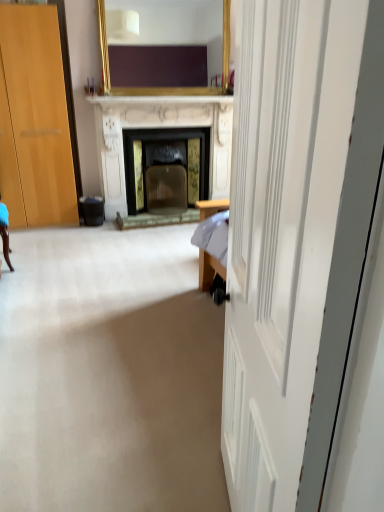
Measure the distance between gold-framed mirror at upper center and camera.

gold-framed mirror at upper center is 3.36 meters away from camera.

This screenshot has width=384, height=512. Describe the element at coordinates (92, 210) in the screenshot. I see `black plastic trash bin at lower left` at that location.

Identify the location of white marble fireplace at center. This screenshot has height=512, width=384. (154, 130).

You are a GUI agent. You are given a task and a screenshot of the screen. Output one action in this format:
    pyautogui.click(x=<x>, y=<y>)
    Task: Click on the gold-framed mirror at upper center
    The image size is (384, 512).
    Given the screenshot: What is the action you would take?
    pyautogui.click(x=164, y=88)

From a real-world perspective, is gold-framed mirror at upper center located higher than black plastic trash bin at lower left?

Yes, from a real-world perspective, gold-framed mirror at upper center is over black plastic trash bin at lower left

Is gold-framed mirror at upper center wider or thinner than black plastic trash bin at lower left?

In the image, gold-framed mirror at upper center appears to be more narrow than black plastic trash bin at lower left.

Is black plastic trash bin at lower left inside gold-framed mirror at upper center?

No, black plastic trash bin at lower left is not a part of gold-framed mirror at upper center.

Which is in front, point (104, 17) or point (95, 208)?

Positioned in front is point (95, 208).

Does gold-framed mirror at upper center have a larger size compared to white wooden door at center?

Actually, gold-framed mirror at upper center might be smaller than white wooden door at center.

Based on the photo, is gold-framed mirror at upper center next to white wooden door at center and touching it?

There is a gap between gold-framed mirror at upper center and white wooden door at center.

Is gold-framed mirror at upper center at the right side of white wooden door at center?

No.

From a real-world perspective, who is located higher, gold-framed mirror at upper center or white marble fireplace at center?

From a 3D spatial view, gold-framed mirror at upper center is above.

Looking at this image, from the image's perspective, which is above, gold-framed mirror at upper center or white marble fireplace at center?

gold-framed mirror at upper center appears higher in the image.

Is the depth of gold-framed mirror at upper center greater than that of white marble fireplace at center?

That is False.

Does point (308, 345) come in front of point (100, 13)?

Yes, it is.

Is white wooden door at center facing away from gold-framed mirror at upper center?

white wooden door at center is not turned away from gold-framed mirror at upper center.

At what (x,y) coordinates should I click in order to perform the action: click on door below the gold-framed mirror at upper center (from a real-world perspective). Please return your answer as a coordinate pair (x, y). Looking at the image, I should click on (296, 237).

Is gold-framed mirror at upper center surrounded by white wooden door at center?

No.

Which of these two, white wooden door at center or black plastic trash bin at lower left, stands taller?

white wooden door at center.

Identify the location of door that appears in front of the black plastic trash bin at lower left. This screenshot has width=384, height=512. (296, 237).

Is white wooden door at center in front of or behind black plastic trash bin at lower left in the image?

Clearly, white wooden door at center is in front of black plastic trash bin at lower left.

Locate an element on the screen. Image resolution: width=384 pixels, height=512 pixels. trash bin/can below the white marble fireplace at center (from the image's perspective) is located at coordinates (92, 210).

From the picture: Which of these two, black plastic trash bin at lower left or white marble fireplace at center, is wider?

white marble fireplace at center is wider.

Considering the positions of objects black plastic trash bin at lower left and white marble fireplace at center in the image provided, who is in front, black plastic trash bin at lower left or white marble fireplace at center?

white marble fireplace at center is closer to the camera.

Is white marble fireplace at center aimed at gold-framed mirror at upper center?

No, white marble fireplace at center is not turned towards gold-framed mirror at upper center.

Is white marble fireplace at center with gold-framed mirror at upper center?

white marble fireplace at center and gold-framed mirror at upper center are clearly separated.

From a real-world perspective, is white marble fireplace at center under gold-framed mirror at upper center?

Yes.

Which object is positioned more to the right, white marble fireplace at center or gold-framed mirror at upper center?

gold-framed mirror at upper center.

The width and height of the screenshot is (384, 512). Identify the location of trash bin/can that appears behind the gold-framed mirror at upper center. (92, 210).

Locate an element on the screen. door in front of the gold-framed mirror at upper center is located at coordinates (296, 237).

Estimate the real-world distances between objects in this image. Which object is closer to white marble fireplace at center, gold-framed mirror at upper center or black plastic trash bin at lower left?

gold-framed mirror at upper center is closer to white marble fireplace at center.

Which object lies further to the anchor point white wooden door at center, black plastic trash bin at lower left or gold-framed mirror at upper center?

The object further to white wooden door at center is black plastic trash bin at lower left.

Looking at the image, which one is located further to white marble fireplace at center, gold-framed mirror at upper center or white wooden door at center?

white wooden door at center.

When comparing their distances from black plastic trash bin at lower left, does white marble fireplace at center or gold-framed mirror at upper center seem further?

gold-framed mirror at upper center is further to black plastic trash bin at lower left.

When comparing their distances from black plastic trash bin at lower left, does gold-framed mirror at upper center or white marble fireplace at center seem closer?

Based on the image, white marble fireplace at center appears to be nearer to black plastic trash bin at lower left.

Looking at the image, which one is located closer to white wooden door at center, black plastic trash bin at lower left or white marble fireplace at center?

The object closer to white wooden door at center is white marble fireplace at center.

Considering their positions, is gold-framed mirror at upper center positioned closer to white wooden door at center than black plastic trash bin at lower left?

Based on the image, gold-framed mirror at upper center appears to be nearer to white wooden door at center.

Looking at this image, from the image, which object appears to be nearer to gold-framed mirror at upper center, white marble fireplace at center or black plastic trash bin at lower left?

white marble fireplace at center.

Find the location of a particular element. The width and height of the screenshot is (384, 512). fireplace between gold-framed mirror at upper center and black plastic trash bin at lower left in the vertical direction is located at coordinates (154, 130).

Where is `mirror between white wooden door at center and white marble fireplace at center along the z-axis`? This screenshot has width=384, height=512. mirror between white wooden door at center and white marble fireplace at center along the z-axis is located at coordinates (164, 88).

Identify the location of mirror between white wooden door at center and black plastic trash bin at lower left from front to back. (164, 88).

Find the location of a particular element. This screenshot has width=384, height=512. fireplace between white wooden door at center and black plastic trash bin at lower left in the front-back direction is located at coordinates (154, 130).